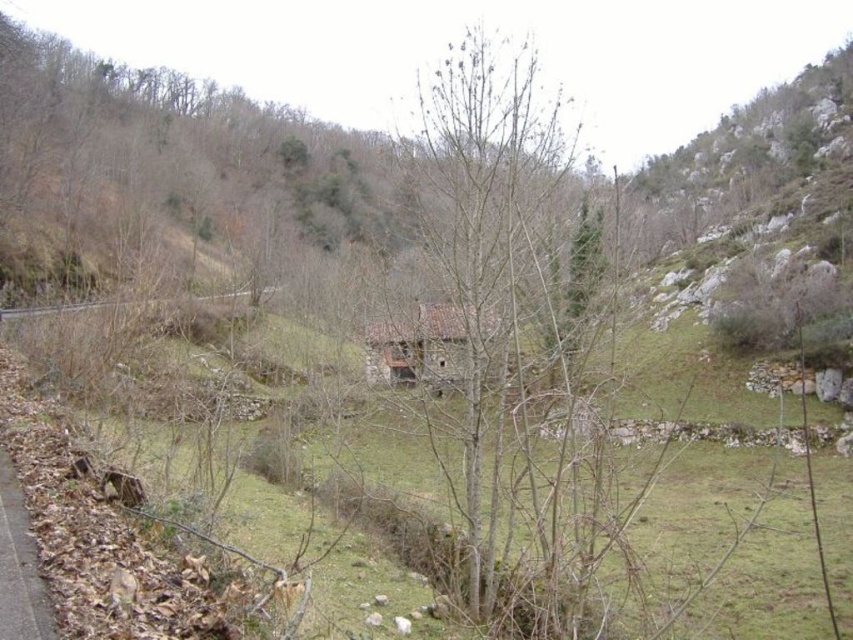
Which is above, brown stone hut at center or brown dirt path at lower left?

brown stone hut at center is above.

Between brown stone hut at center and brown dirt path at lower left, which one has more height?

With more height is brown stone hut at center.

Between point (490, 323) and point (28, 621), which one is positioned behind?

Positioned behind is point (490, 323).

Where is `brown stone hut at center`? The height and width of the screenshot is (640, 853). brown stone hut at center is located at coordinates (422, 344).

Is bare wood at center shorter than brown dirt path at lower left?

Incorrect, bare wood at center's height does not fall short of brown dirt path at lower left's.

Who is positioned more to the left, bare wood at center or brown dirt path at lower left?

From the viewer's perspective, brown dirt path at lower left appears more on the left side.

Locate an element on the screen. Image resolution: width=853 pixels, height=640 pixels. bare wood at center is located at coordinates (482, 275).

Can you confirm if brown stone hut at center is positioned to the left of gray concrete train track at center?

No, brown stone hut at center is not to the left of gray concrete train track at center.

Does point (488, 333) lie in front of point (271, 285)?

Yes, it is.

Is point (395, 356) behind point (265, 288)?

No, it is in front of (265, 288).

Image resolution: width=853 pixels, height=640 pixels. What are the coordinates of `brown stone hut at center` in the screenshot? It's located at (422, 344).